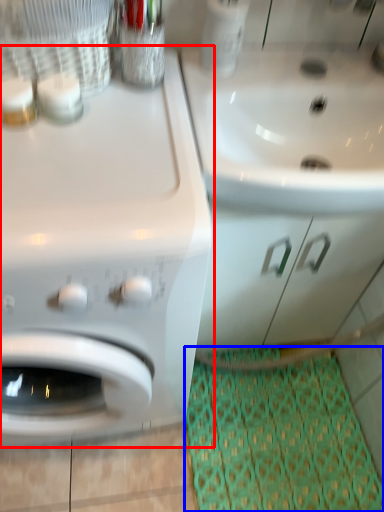
Question: Among these objects, which one is nearest to the camera, washing machine (highlighted by a red box) or doormat (highlighted by a blue box)?

Choices:
 (A) washing machine
 (B) doormat

Answer: (A)